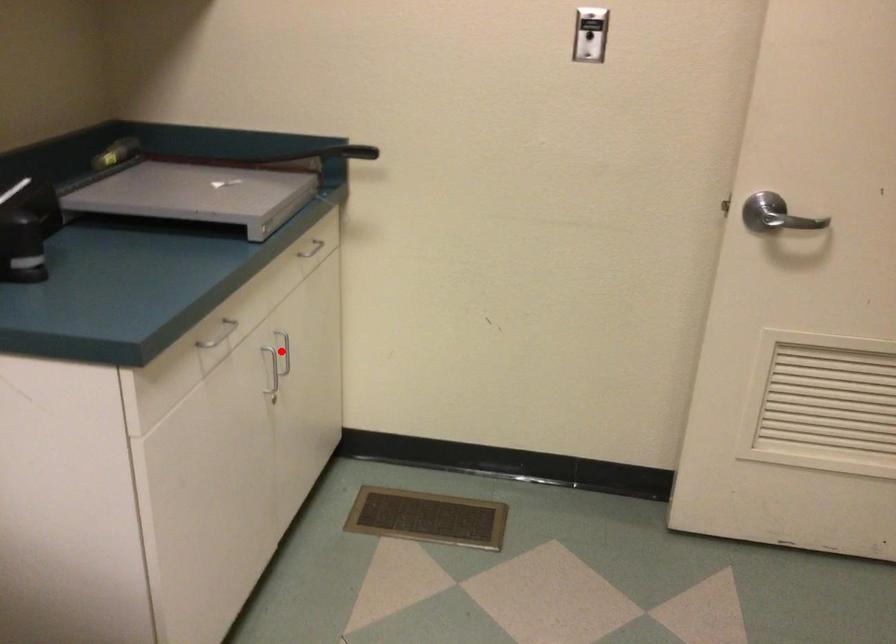
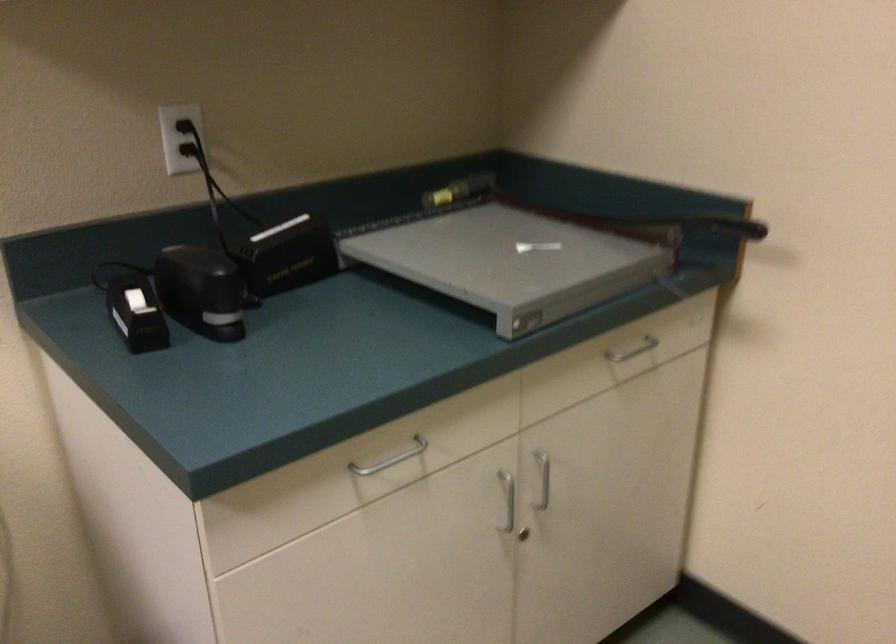
The point at the highlighted location is marked in the first image. Where is the corresponding point in the second image?

(543, 478)